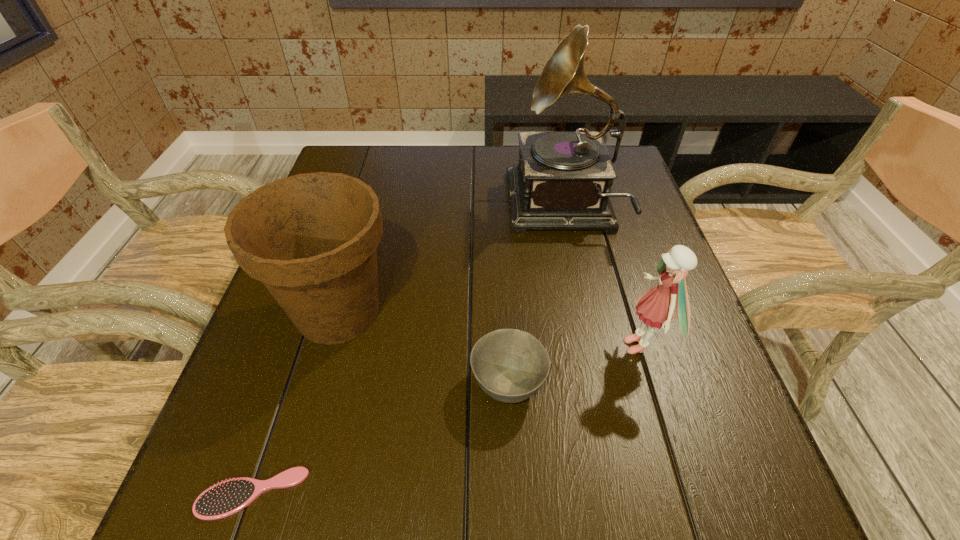
At what (x,y) coordinates should I click in order to perform the action: click on unoccupied position between the nearest object and the doll. Please return your answer as a coordinate pair (x, y). This screenshot has height=540, width=960. Looking at the image, I should click on (446, 420).

You are a GUI agent. You are given a task and a screenshot of the screen. Output one action in this format:
    pyautogui.click(x=<x>, y=<y>)
    Task: Click on the free space that is in between the tallest object and the fourth tallest object
    The height and width of the screenshot is (540, 960).
    Given the screenshot: What is the action you would take?
    tap(535, 296)

Find the location of a particular element. free space between the second shortest object and the record player is located at coordinates (535, 296).

What are the coordinates of `free space between the flowerpot and the shortest object` in the screenshot? It's located at (296, 402).

You are a GUI agent. You are given a task and a screenshot of the screen. Output one action in this format:
    pyautogui.click(x=<x>, y=<y>)
    Task: Click on the unoccupied position between the hairbrush and the bowl
    
    Given the screenshot: What is the action you would take?
    pyautogui.click(x=380, y=439)

The height and width of the screenshot is (540, 960). What are the coordinates of `free point between the fourth tallest object and the doll` in the screenshot? It's located at (574, 365).

Locate an element on the screen. vacant space that is in between the nearest object and the doll is located at coordinates (446, 420).

Where is `unoccupied position between the doll and the fourth tallest object`? The image size is (960, 540). unoccupied position between the doll and the fourth tallest object is located at coordinates (574, 365).

Identify the location of free space between the bowl and the flowerpot. (423, 348).

In order to click on object that can be found as the closest to the record player in this screenshot , I will do `click(657, 306)`.